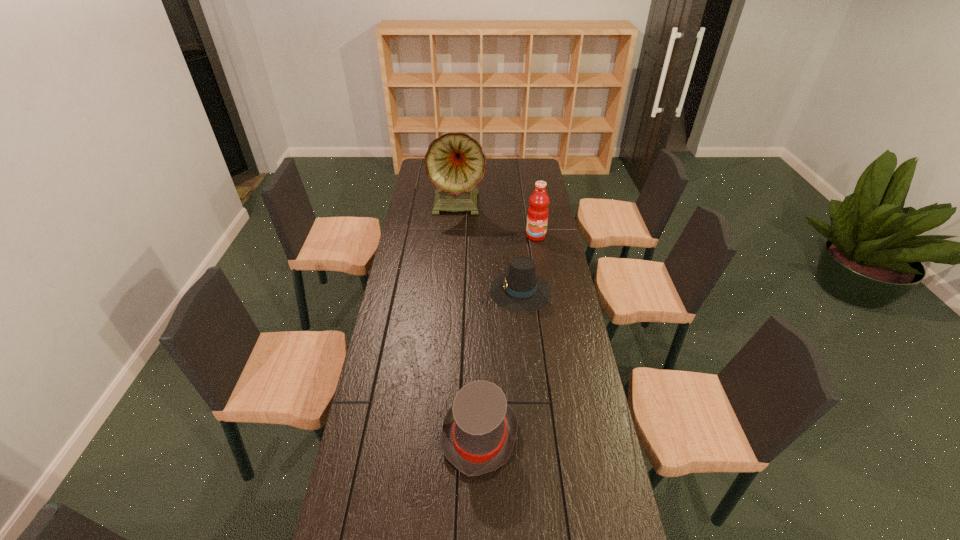
Identify the location of the tallest object. This screenshot has height=540, width=960. (455, 163).

This screenshot has height=540, width=960. I want to click on record player, so click(x=455, y=163).

Image resolution: width=960 pixels, height=540 pixels. Find the location of `fruit juice`. fruit juice is located at coordinates (538, 211).

Where is `the third shortest object`? Image resolution: width=960 pixels, height=540 pixels. the third shortest object is located at coordinates (538, 211).

The height and width of the screenshot is (540, 960). I want to click on the nearest object, so click(x=479, y=430).

Where is `the second nearest object`? The width and height of the screenshot is (960, 540). the second nearest object is located at coordinates (520, 290).

The image size is (960, 540). What are the coordinates of `free space located 0.150m from the horn of the tallest object` in the screenshot? It's located at (456, 242).

Identify the location of vacant space located 0.380m on the front label of the fruit juice. The image size is (960, 540). (546, 297).

At what (x,y) coordinates should I click in order to perform the action: click on vacant region located 0.080m on the right of the nearer hat. Please return your answer as a coordinate pair (x, y). Looking at the image, I should click on (544, 435).

At what (x,y) coordinates should I click in order to perform the action: click on free point located on the front-facing side of the farther hat. Please return your answer as a coordinate pair (x, y). Looking at the image, I should click on (478, 291).